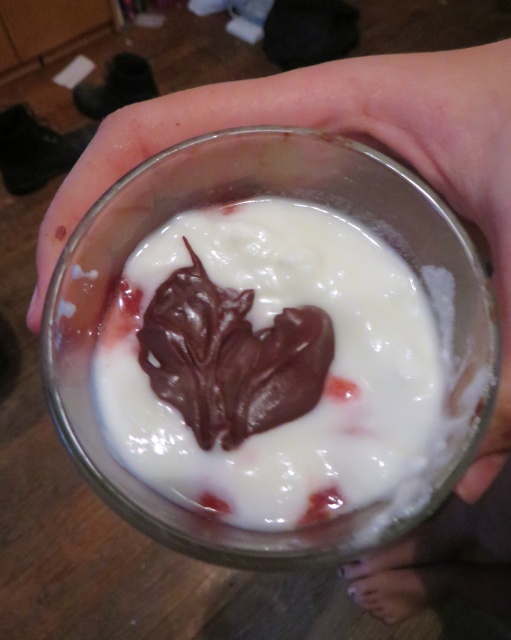
Question: Which object is closer to the camera taking this photo?

Choices:
 (A) transparent glass at center
 (B) smooth white yogurt at center

Answer: (A)

Question: Which of the following is the farthest from the observer?

Choices:
 (A) smooth white yogurt at center
 (B) transparent glass at center

Answer: (A)

Question: Can you confirm if smooth white yogurt at center is smaller than transparent glass at center?

Choices:
 (A) no
 (B) yes

Answer: (B)

Question: Is smooth white yogurt at center closer to the viewer compared to transparent glass at center?

Choices:
 (A) yes
 (B) no

Answer: (B)

Question: Where is smooth white yogurt at center located in relation to transparent glass at center in the image?

Choices:
 (A) left
 (B) right

Answer: (A)

Question: Which of the following is the closest to the observer?

Choices:
 (A) transparent glass at center
 (B) smooth white yogurt at center

Answer: (A)